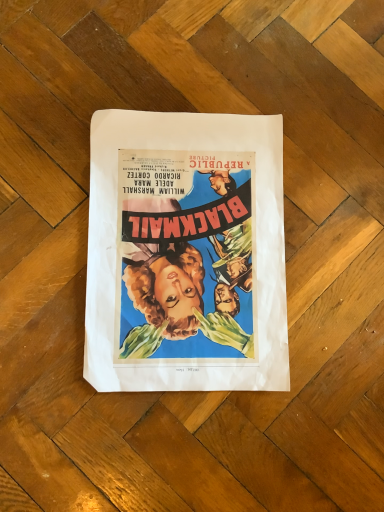
You are a GUI agent. You are given a task and a screenshot of the screen. Output one action in this format:
    pyautogui.click(x=<x>, y=<y>)
    Task: Click on the vacant space situated above vibrant paper poster at center (from a real-world perspective)
    Image resolution: width=384 pixels, height=512 pixels.
    Given the screenshot: What is the action you would take?
    pyautogui.click(x=197, y=240)